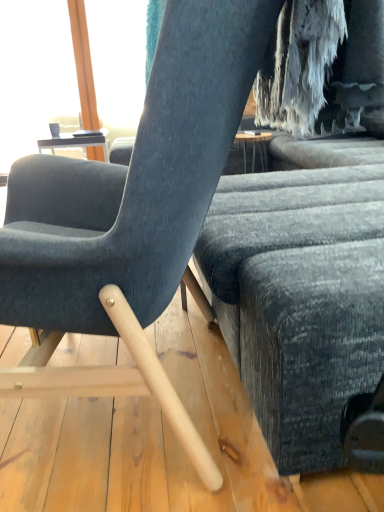
Question: Is textured gray fabric couch at center thinner than matte black screen at upper left?

Choices:
 (A) no
 (B) yes

Answer: (A)

Question: Does textured gray fabric couch at center have a greater width compared to matte black screen at upper left?

Choices:
 (A) yes
 (B) no

Answer: (A)

Question: Is matte black screen at upper left located within textured gray fabric couch at center?

Choices:
 (A) yes
 (B) no

Answer: (B)

Question: Would you say textured gray fabric couch at center is outside matte black screen at upper left?

Choices:
 (A) no
 (B) yes

Answer: (B)

Question: Are textured gray fabric couch at center and matte black screen at upper left far apart?

Choices:
 (A) yes
 (B) no

Answer: (A)

Question: Can you confirm if textured gray fabric couch at center is bigger than matte black screen at upper left?

Choices:
 (A) yes
 (B) no

Answer: (A)

Question: Is matte black screen at upper left thinner than matte gray chair at center?

Choices:
 (A) yes
 (B) no

Answer: (A)

Question: Is matte black screen at upper left wider than matte gray chair at center?

Choices:
 (A) no
 (B) yes

Answer: (A)

Question: Is matte black screen at upper left positioned behind matte gray chair at center?

Choices:
 (A) no
 (B) yes

Answer: (B)

Question: Is matte black screen at upper left at the left side of matte gray chair at center?

Choices:
 (A) yes
 (B) no

Answer: (A)

Question: From a real-world perspective, is matte black screen at upper left over matte gray chair at center?

Choices:
 (A) no
 (B) yes

Answer: (B)

Question: Does matte black screen at upper left appear on the right side of matte gray chair at center?

Choices:
 (A) yes
 (B) no

Answer: (B)

Question: From a real-world perspective, is matte black screen at upper left below textured gray fabric couch at center?

Choices:
 (A) yes
 (B) no

Answer: (B)